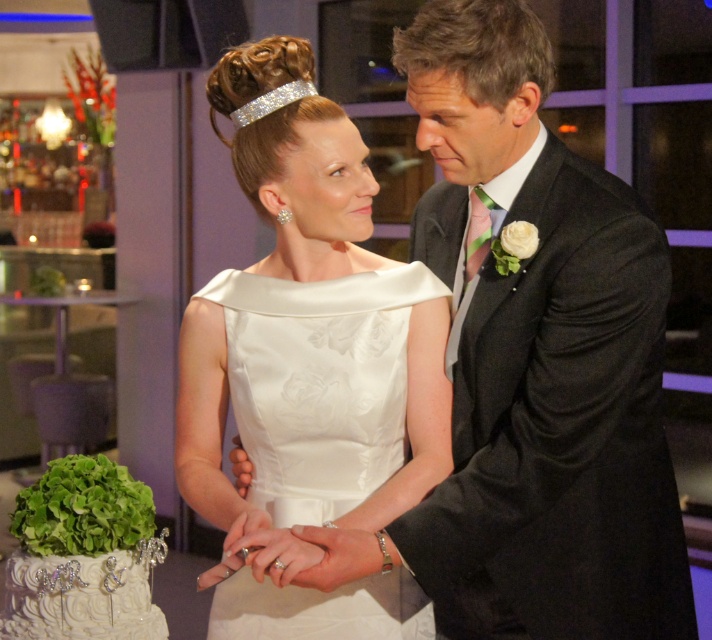
You are a photographer at the wedding and want to capture a photo of the satin dress at center and the white textured cake at lower left. Which object is taller in the image?

The satin dress at center is taller than the white textured cake at lower left.

You are a photographer at the wedding and need to adjust the lighting to ensure both the black textured suit at center and the satin dress at center are well illuminated. Considering their sizes, which one might require a wider light spread to cover its entire surface?

The black textured suit at center requires a wider light spread because its width is larger than the satin dress at center, so it needs more coverage to ensure proper illumination.

You are a photographer at the wedding and want to capture the couple cutting the cake. The satin dress at center is at point 0.567,0.435. Where should you position your camera to ensure the dress is centered in the frame?

To ensure the satin dress at center is centered in the frame, position the camera directly facing the coordinates (308,362) where the dress is located.